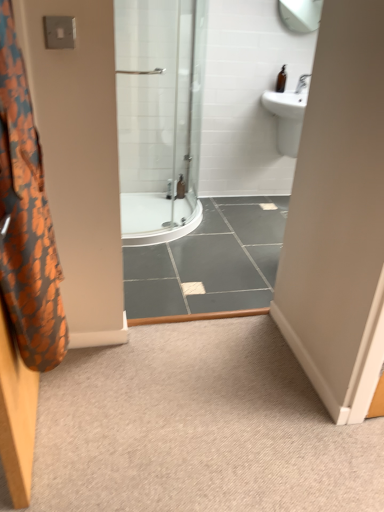
Question: Does brown glass bottle at upper right, marked as the 1th toiletry in a front-to-back arrangement, have a smaller size compared to carpet at center?

Choices:
 (A) no
 (B) yes

Answer: (B)

Question: Considering the relative sizes of brown glass bottle at upper right, marked as the 1th toiletry in a front-to-back arrangement, and carpet at center in the image provided, is brown glass bottle at upper right, marked as the 1th toiletry in a front-to-back arrangement, wider than carpet at center?

Choices:
 (A) yes
 (B) no

Answer: (B)

Question: From the image's perspective, is brown glass bottle at upper right, which appears as the second toiletry when ordered from the bottom, located above carpet at center?

Choices:
 (A) no
 (B) yes

Answer: (B)

Question: Is brown glass bottle at upper right, which is counted as the 1th toiletry, starting from the top, not close to carpet at center?

Choices:
 (A) no
 (B) yes

Answer: (B)

Question: Is brown glass bottle at upper right, which is counted as the 1th toiletry, starting from the top, shorter than carpet at center?

Choices:
 (A) yes
 (B) no

Answer: (B)

Question: Would you say carpet at center is part of brown glass bottle at upper right, which is counted as the 1th toiletry, starting from the top,'s contents?

Choices:
 (A) yes
 (B) no

Answer: (B)

Question: From the image's perspective, is clear plastic bottle at center, which is the 1th toiletry in bottom-to-top order, on top of orange fabric shower curtain at left?

Choices:
 (A) no
 (B) yes

Answer: (B)

Question: Is clear plastic bottle at center, which is the 1th toiletry in bottom-to-top order, looking in the opposite direction of orange fabric shower curtain at left?

Choices:
 (A) yes
 (B) no

Answer: (B)

Question: From the image's perspective, is clear plastic bottle at center, which is the 1th toiletry in bottom-to-top order, below orange fabric shower curtain at left?

Choices:
 (A) yes
 (B) no

Answer: (B)

Question: Can you confirm if clear plastic bottle at center, which is the 1th toiletry in bottom-to-top order, is positioned to the right of orange fabric shower curtain at left?

Choices:
 (A) no
 (B) yes

Answer: (B)

Question: Is clear plastic bottle at center, which is the 2th toiletry in front-to-back order, shorter than orange fabric shower curtain at left?

Choices:
 (A) yes
 (B) no

Answer: (A)

Question: From a real-world perspective, is clear plastic bottle at center, which is the 1th toiletry in bottom-to-top order, positioned under orange fabric shower curtain at left based on gravity?

Choices:
 (A) no
 (B) yes

Answer: (B)

Question: Is clear plastic bottle at center, which appears as the first toiletry when viewed from the left, at the right side of carpet at center?

Choices:
 (A) no
 (B) yes

Answer: (A)